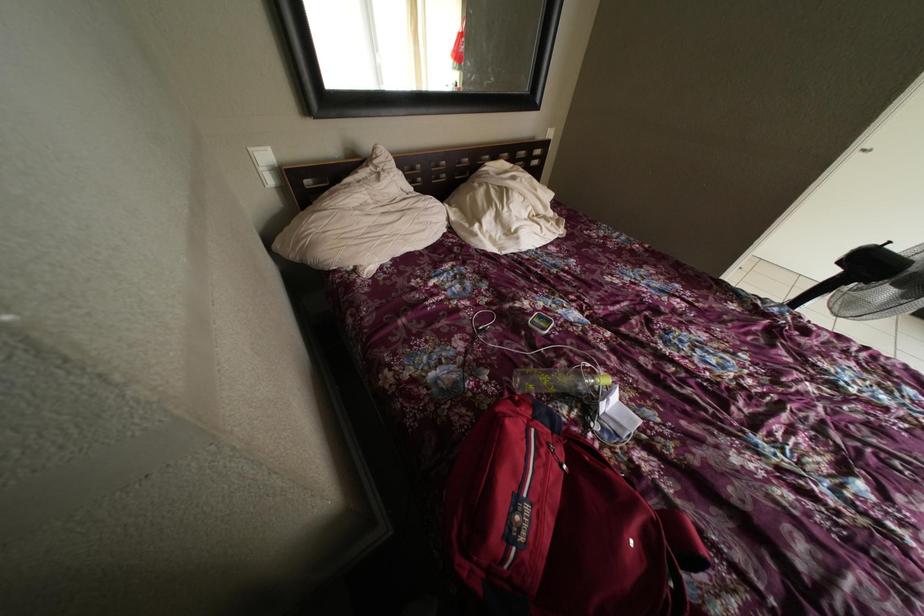
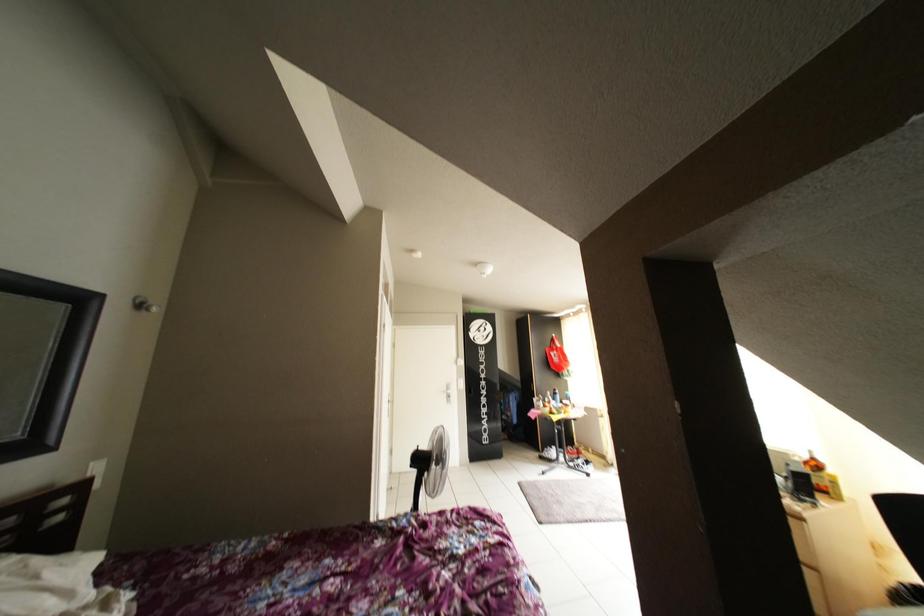
Based on the continuous images, in which direction is the camera rotating?

The rotation direction of the camera is right-up.